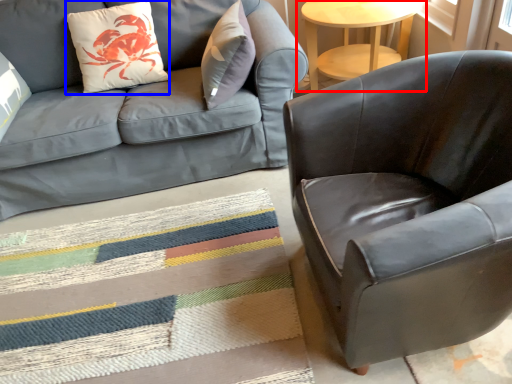
Question: Which point is closer to the camera, table (highlighted by a red box) or throw pillow (highlighted by a blue box)?

Choices:
 (A) table
 (B) throw pillow

Answer: (B)